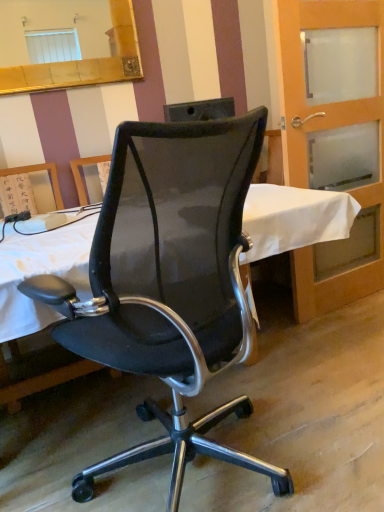
Question: Is translucent glass door at right taller than black mesh office chair at center?

Choices:
 (A) no
 (B) yes

Answer: (B)

Question: Can we say translucent glass door at right lies outside black mesh office chair at center?

Choices:
 (A) no
 (B) yes

Answer: (B)

Question: From the image's perspective, is translucent glass door at right located above black mesh office chair at center?

Choices:
 (A) no
 (B) yes

Answer: (B)

Question: Is translucent glass door at right positioned in front of black mesh office chair at center?

Choices:
 (A) no
 (B) yes

Answer: (A)

Question: Is translucent glass door at right thinner than black mesh office chair at center?

Choices:
 (A) yes
 (B) no

Answer: (A)

Question: Choose the correct answer: Is gold-framed mirror at upper left inside translucent glass door at right or outside it?

Choices:
 (A) outside
 (B) inside

Answer: (A)

Question: Considering the positions of gold-framed mirror at upper left and translucent glass door at right in the image, is gold-framed mirror at upper left taller or shorter than translucent glass door at right?

Choices:
 (A) tall
 (B) short

Answer: (B)

Question: Would you say gold-framed mirror at upper left is to the left or to the right of translucent glass door at right in the picture?

Choices:
 (A) left
 (B) right

Answer: (A)

Question: Considering their positions, is gold-framed mirror at upper left located in front of or behind translucent glass door at right?

Choices:
 (A) behind
 (B) front

Answer: (A)

Question: Does point (175, 125) appear closer or farther from the camera than point (29, 80)?

Choices:
 (A) closer
 (B) farther

Answer: (A)

Question: From a real-world perspective, is black mesh office chair at center above or below gold-framed mirror at upper left?

Choices:
 (A) above
 (B) below

Answer: (B)

Question: In the image, is black mesh office chair at center positioned in front of or behind gold-framed mirror at upper left?

Choices:
 (A) behind
 (B) front

Answer: (B)

Question: Is black mesh office chair at center wider or thinner than gold-framed mirror at upper left?

Choices:
 (A) wide
 (B) thin

Answer: (A)

Question: From the image's perspective, relative to gold-framed mirror at upper left, is translucent glass door at right above or below?

Choices:
 (A) above
 (B) below

Answer: (B)

Question: Considering the relative positions of translucent glass door at right and gold-framed mirror at upper left in the image provided, is translucent glass door at right to the left or to the right of gold-framed mirror at upper left?

Choices:
 (A) right
 (B) left

Answer: (A)